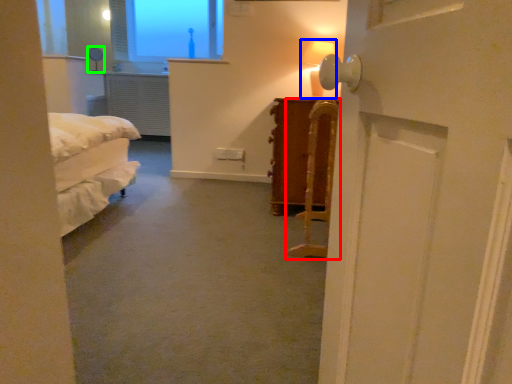
Question: Which object is the farthest from furniture (highlighted by a red box)? Choose among these: table lamp (highlighted by a blue box) or table lamp (highlighted by a green box).

Choices:
 (A) table lamp
 (B) table lamp

Answer: (B)